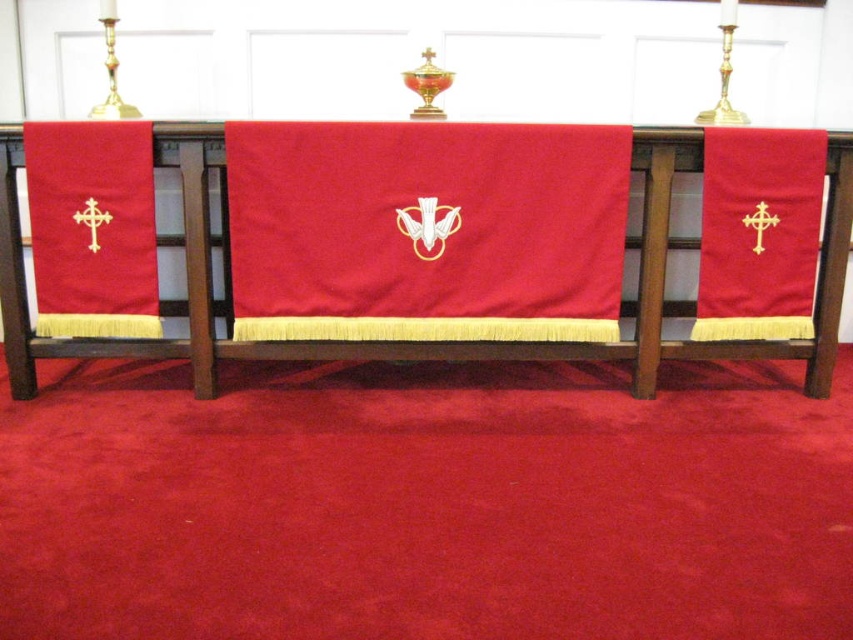
You are an altar server preparing for a service. You need to place a new candle between the matte red fabric cross at left and the matte gold cross at right. Based on their positions, where should you place the candle to ensure it is centered between them?

The matte red fabric cross at left is to the left of the matte gold cross at right, so placing the candle exactly halfway between them will center it between the two crosses.

Based on the scene description, which object is shorter between the matte red fabric cross at left and the matte gold cross at right?

The matte red fabric cross at left is shorter than the matte gold cross at right.

You are standing in front of the church altar and want to place a small flower bouquet on the matte red cloth at center. Based on the coordinates provided, where exactly should you place it?

The matte red cloth at center is located at coordinates point (426,230), so you should place the flower bouquet at that exact point.